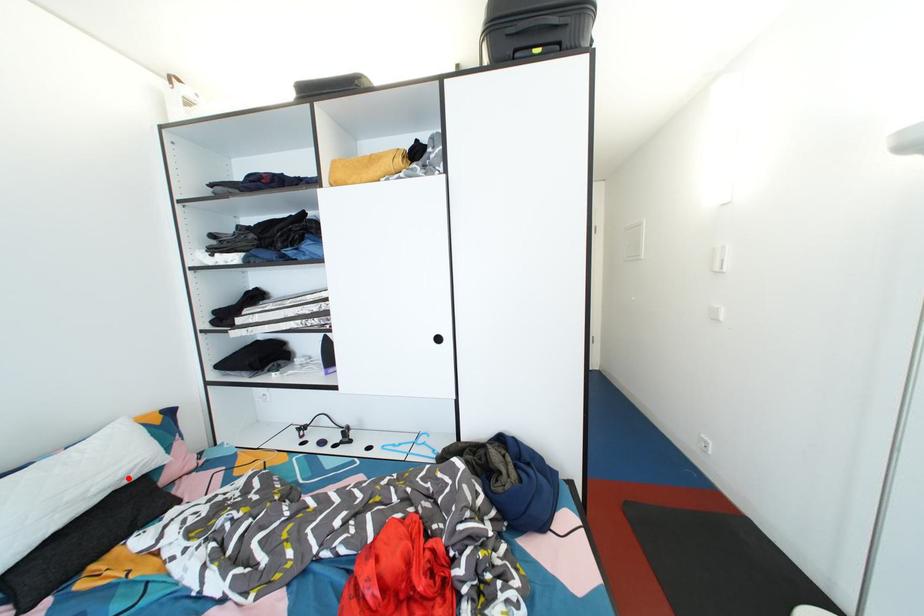
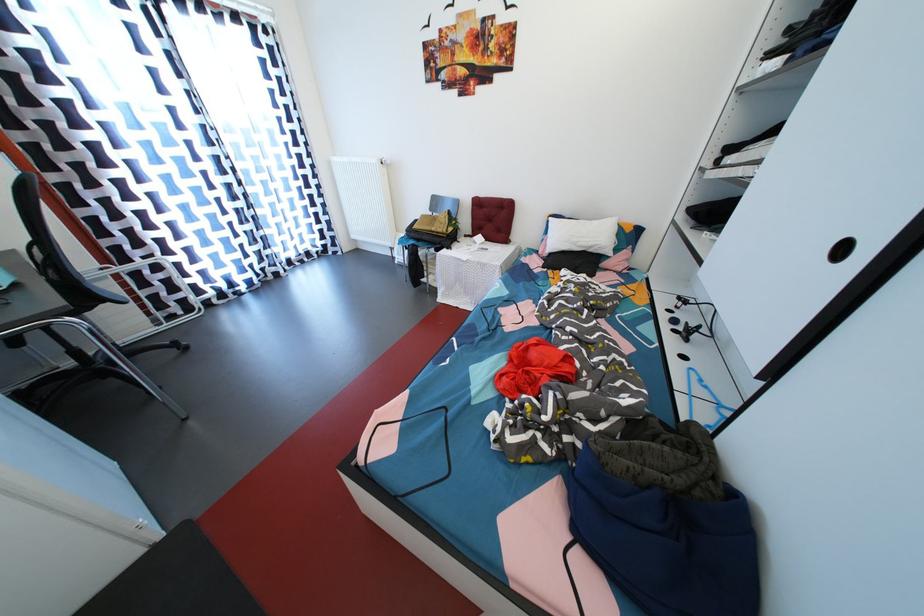
Question: A red point is marked in image1. In image2, is the corresponding 3D point closer to the camera or farther? Reply with the corresponding letter.

Choices:
 (A) The corresponding 3D point is closer.
 (B) The corresponding 3D point is farther.

Answer: (A)